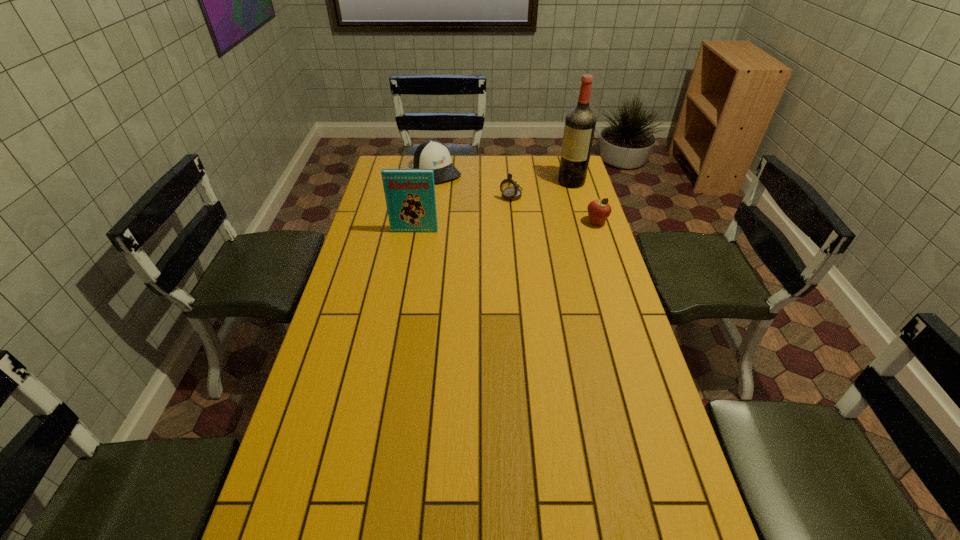
Find the location of a particular element. The image size is (960, 540). apple that is at the right edge is located at coordinates (599, 210).

The height and width of the screenshot is (540, 960). Identify the location of liquor positioned at the right edge. (580, 122).

In order to click on object situated at the far left corner in this screenshot , I will do `click(432, 154)`.

Where is `object present at the far right corner`? Image resolution: width=960 pixels, height=540 pixels. object present at the far right corner is located at coordinates (580, 122).

Image resolution: width=960 pixels, height=540 pixels. In the image, there is a desktop. What are the coordinates of `vacant space at the far edge` in the screenshot? It's located at (482, 164).

The height and width of the screenshot is (540, 960). What are the coordinates of `vacant space at the near edge of the desktop` in the screenshot? It's located at (446, 525).

Where is `vacant space at the left edge of the desktop`? The width and height of the screenshot is (960, 540). vacant space at the left edge of the desktop is located at coordinates (302, 463).

The height and width of the screenshot is (540, 960). What are the coordinates of `blank space at the right edge` in the screenshot? It's located at (585, 260).

Image resolution: width=960 pixels, height=540 pixels. Find the location of `free space at the far right corner of the desktop`. free space at the far right corner of the desktop is located at coordinates [547, 175].

Where is `vacant area that lies between the apple and the compass`? This screenshot has height=540, width=960. vacant area that lies between the apple and the compass is located at coordinates (x=554, y=209).